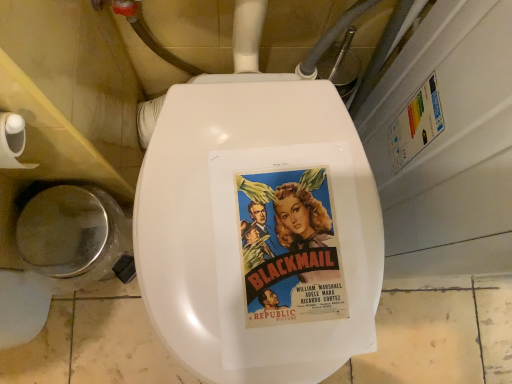
Image resolution: width=512 pixels, height=384 pixels. I want to click on free space above shiny silver lid at lower left (from a real-world perspective), so point(56,238).